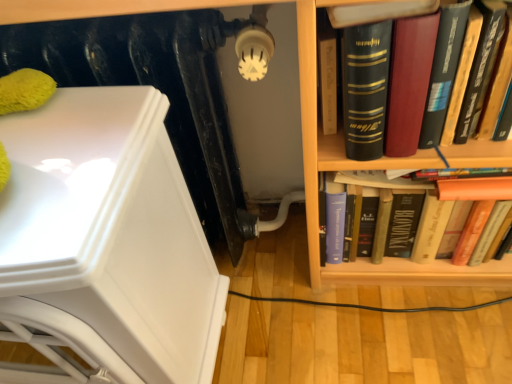
What do you see at coordinates (499, 81) in the screenshot? I see `hardcover book at right` at bounding box center [499, 81].

This screenshot has width=512, height=384. Find the location of `black matte radiator at upper left`. black matte radiator at upper left is located at coordinates (156, 88).

The image size is (512, 384). What are the coordinates of `hardcover book at right` in the screenshot? It's located at click(499, 81).

From a real-world perspective, between wooden bookshelf at right and hardcover book at right, who is vertically higher?

hardcover book at right is physically above.

Which point is more forward, (302, 61) or (391, 101)?

Point (302, 61)

From the image's perspective, is wooden bookshelf at right located above or below hardcover book at right?

wooden bookshelf at right is situated lower than hardcover book at right in the image.

Where is `book above the wooden bookshelf at right (from a real-world perspective)`? The image size is (512, 384). book above the wooden bookshelf at right (from a real-world perspective) is located at coordinates (499, 81).

Based on the photo, how many degrees apart are the facing directions of wooden bookshelf at right and white glossy armchair at left?

The angle between the facing direction of wooden bookshelf at right and the facing direction of white glossy armchair at left is 0.000241 degrees.

From the image's perspective, is wooden bookshelf at right beneath white glossy armchair at left?

Incorrect, from the image's perspective, wooden bookshelf at right is higher than white glossy armchair at left.

This screenshot has height=384, width=512. I want to click on bookcase behind the white glossy armchair at left, so [365, 168].

Consider the image. Between wooden bookshelf at right and white glossy armchair at left, which one has larger size?

wooden bookshelf at right is bigger.

Considering the positions of objects black matte radiator at upper left and hardcover book at right in the image provided, who is behind, black matte radiator at upper left or hardcover book at right?

black matte radiator at upper left.

In the scene shown: Is black matte radiator at upper left turned away from hardcover book at right?

black matte radiator at upper left is not turned away from hardcover book at right.

Does black matte radiator at upper left have a greater width compared to hardcover book at right?

Correct, the width of black matte radiator at upper left exceeds that of hardcover book at right.

From the image's perspective, which is below, black matte radiator at upper left or hardcover book at right?

From the image's view, black matte radiator at upper left is below.

Is white glossy armchair at left closer to the viewer compared to black matte radiator at upper left?

Yes.

Can you confirm if white glossy armchair at left is bigger than black matte radiator at upper left?

Indeed, white glossy armchair at left has a larger size compared to black matte radiator at upper left.

From the image's perspective, who appears lower, white glossy armchair at left or black matte radiator at upper left?

From the image's view, white glossy armchair at left is below.

Is white glossy armchair at left facing away from black matte radiator at upper left?

That's right, white glossy armchair at left is facing away from black matte radiator at upper left.

From the image's perspective, relative to black matte radiator at upper left, is wooden bookshelf at right above or below?

Clearly, from the image's perspective, wooden bookshelf at right is above black matte radiator at upper left.

Is wooden bookshelf at right next to black matte radiator at upper left?

There is a gap between wooden bookshelf at right and black matte radiator at upper left.

Image resolution: width=512 pixels, height=384 pixels. Find the location of `radiator that is behind the wooden bookshelf at right`. radiator that is behind the wooden bookshelf at right is located at coordinates (156, 88).

Would you say wooden bookshelf at right is outside black matte radiator at upper left?

Absolutely, wooden bookshelf at right is external to black matte radiator at upper left.

Considering the positions of point (496, 110) and point (146, 278), is point (496, 110) closer or farther from the camera than point (146, 278)?

Point (496, 110).

Is hardcover book at right oriented away from white glossy armchair at left?

No.

Between hardcover book at right and white glossy armchair at left, which one has larger width?

white glossy armchair at left is wider.

Who is shorter, white glossy armchair at left or hardcover book at right?

With less height is hardcover book at right.

Considering the sizes of white glossy armchair at left and hardcover book at right in the image, is white glossy armchair at left bigger or smaller than hardcover book at right?

Clearly, white glossy armchair at left is larger in size than hardcover book at right.

Is white glossy armchair at left to the left of hardcover book at right from the viewer's perspective?

Yes, white glossy armchair at left is to the left of hardcover book at right.

Is white glossy armchair at left in front of or behind hardcover book at right in the image?

Visually, white glossy armchair at left is located in front of hardcover book at right.

Locate an element on the screen. The image size is (512, 384). bookcase that is under the hardcover book at right (from a real-world perspective) is located at coordinates pyautogui.click(x=365, y=168).

The height and width of the screenshot is (384, 512). Find the location of `bookcase above the white glossy armchair at left (from a real-world perspective)`. bookcase above the white glossy armchair at left (from a real-world perspective) is located at coordinates (365, 168).

Estimate the real-world distances between objects in this image. Which object is further from wooden bookshelf at right, hardcover book at right or black matte radiator at upper left?

black matte radiator at upper left is positioned further to the anchor wooden bookshelf at right.

Looking at the image, which one is located further to black matte radiator at upper left, wooden bookshelf at right or white glossy armchair at left?

wooden bookshelf at right lies further to black matte radiator at upper left than the other object.

Considering their positions, is hardcover book at right positioned closer to white glossy armchair at left than black matte radiator at upper left?

black matte radiator at upper left.

From the image, which object appears to be farther from black matte radiator at upper left, hardcover book at right or wooden bookshelf at right?

hardcover book at right is positioned further to the anchor black matte radiator at upper left.

When comparing their distances from white glossy armchair at left, does black matte radiator at upper left or wooden bookshelf at right seem closer?

black matte radiator at upper left is closer to white glossy armchair at left.

When comparing their distances from hardcover book at right, does wooden bookshelf at right or black matte radiator at upper left seem closer?

wooden bookshelf at right is positioned closer to the anchor hardcover book at right.

From the image, which object appears to be nearer to white glossy armchair at left, wooden bookshelf at right or black matte radiator at upper left?

black matte radiator at upper left is positioned closer to the anchor white glossy armchair at left.

Looking at this image, estimate the real-world distances between objects in this image. Which object is closer to wooden bookshelf at right, white glossy armchair at left or hardcover book at right?

hardcover book at right.

Where is `radiator between white glossy armchair at left and wooden bookshelf at right`? The width and height of the screenshot is (512, 384). radiator between white glossy armchair at left and wooden bookshelf at right is located at coordinates (156, 88).

Find the location of a particular element. This screenshot has height=384, width=512. radiator between white glossy armchair at left and hardcover book at right in the horizontal direction is located at coordinates (156, 88).

I want to click on book located between white glossy armchair at left and wooden bookshelf at right in the left-right direction, so tap(499, 81).

Where is `book between black matte radiator at upper left and wooden bookshelf at right from left to right`? book between black matte radiator at upper left and wooden bookshelf at right from left to right is located at coordinates (499, 81).